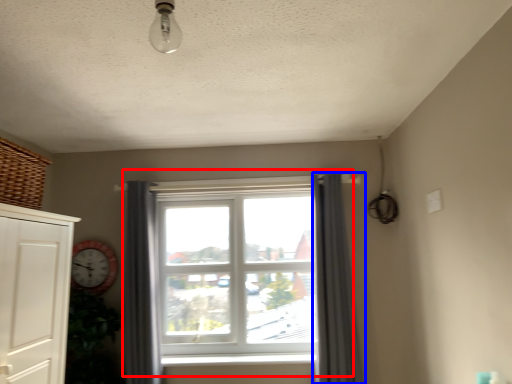
Question: Which of the following is the farthest to the observer, window (highlighted by a red box) or curtain (highlighted by a blue box)?

Choices:
 (A) window
 (B) curtain

Answer: (A)